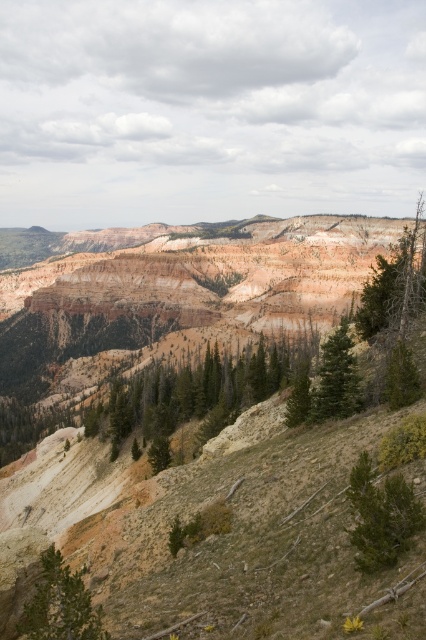
Question: Is green matte tree at lower left positioned at the back of green matte tree at center-right?

Choices:
 (A) yes
 (B) no

Answer: (B)

Question: Is green matte tree at lower left smaller than green textured tree at right?

Choices:
 (A) yes
 (B) no

Answer: (A)

Question: Which of these objects is positioned farthest from the green matte tree at center?

Choices:
 (A) green matte tree at center-right
 (B) green matte tree at upper right
 (C) green textured tree at right

Answer: (C)

Question: Which object is farther from the camera taking this photo?

Choices:
 (A) green textured pine at lower right
 (B) green textured tree at center

Answer: (B)

Question: Which point is farther to the camera?

Choices:
 (A) (396, 284)
 (B) (393, 388)
 (C) (393, 476)
 (D) (333, 337)

Answer: (A)

Question: Is green matte tree at upper right further to camera compared to green matte tree at center?

Choices:
 (A) yes
 (B) no

Answer: (B)